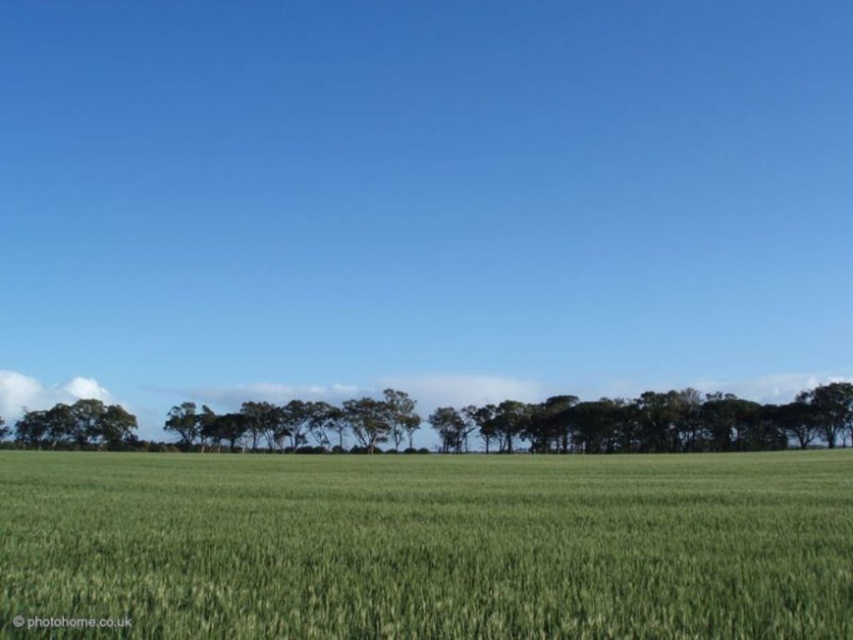
You are standing in the middle of the green grassy wheat field at center and want to walk towards the green leafy tree at center. Which direction should you walk to reach the tree?

The green grassy wheat field at center is in front of the green leafy tree at center, so you should walk forward to reach the tree since the field is closer to you than the tree.

You are a drone operator trying to capture a photo of the green grassy wheat field at center and the green leafy tree at center. Which object should you focus on if you want to ensure the entire subject fits within the camera frame?

The green grassy wheat field at center might be wider than green leafy tree at center, so focusing on the wider subject would ensure the entire area fits within the camera frame.